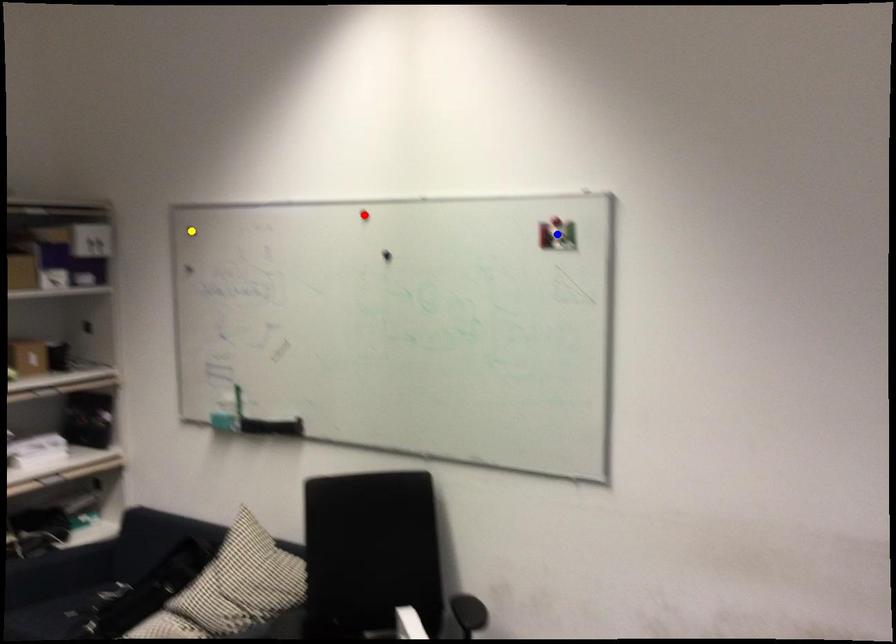
Order these from nearest to farthest:
1. blue point
2. yellow point
3. red point

yellow point, red point, blue point